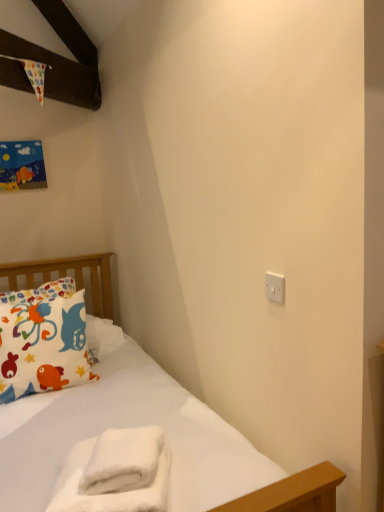
Question: Considering the relative positions of white plastic switch at upper right and white fluffy towel at lower center in the image provided, is white plastic switch at upper right in front of white fluffy towel at lower center?

Choices:
 (A) no
 (B) yes

Answer: (A)

Question: Can you confirm if white plastic switch at upper right is smaller than white fluffy towel at lower center?

Choices:
 (A) yes
 (B) no

Answer: (A)

Question: From a real-world perspective, is white plastic switch at upper right located beneath white fluffy towel at lower center?

Choices:
 (A) no
 (B) yes

Answer: (A)

Question: From the image's perspective, is white plastic switch at upper right located above white fluffy towel at lower center?

Choices:
 (A) no
 (B) yes

Answer: (B)

Question: Is white plastic switch at upper right bigger than white fluffy towel at lower center?

Choices:
 (A) yes
 (B) no

Answer: (B)

Question: Considering the positions of white fluffy towel at lower center and printed fabric pillow at left in the image, is white fluffy towel at lower center wider or thinner than printed fabric pillow at left?

Choices:
 (A) thin
 (B) wide

Answer: (B)

Question: Considering the positions of white fluffy towel at lower center and printed fabric pillow at left in the image, is white fluffy towel at lower center taller or shorter than printed fabric pillow at left?

Choices:
 (A) short
 (B) tall

Answer: (A)

Question: Is white fluffy towel at lower center situated inside printed fabric pillow at left or outside?

Choices:
 (A) outside
 (B) inside

Answer: (A)

Question: Is white fluffy towel at lower center in front of or behind printed fabric pillow at left in the image?

Choices:
 (A) behind
 (B) front

Answer: (B)

Question: Is printed fabric pillow at left in front of or behind white fluffy towel at lower center in the image?

Choices:
 (A) behind
 (B) front

Answer: (A)

Question: Looking at the image, does printed fabric pillow at left seem bigger or smaller compared to white fluffy towel at lower center?

Choices:
 (A) big
 (B) small

Answer: (A)

Question: From a real-world perspective, is printed fabric pillow at left positioned above or below white fluffy towel at lower center?

Choices:
 (A) below
 (B) above

Answer: (B)

Question: From the image's perspective, relative to white fluffy towel at lower center, is printed fabric pillow at left above or below?

Choices:
 (A) below
 (B) above

Answer: (B)

Question: Is point (77, 305) closer or farther from the camera than point (279, 281)?

Choices:
 (A) farther
 (B) closer

Answer: (A)

Question: Is printed fabric pillow at left wider or thinner than white plastic switch at upper right?

Choices:
 (A) thin
 (B) wide

Answer: (B)